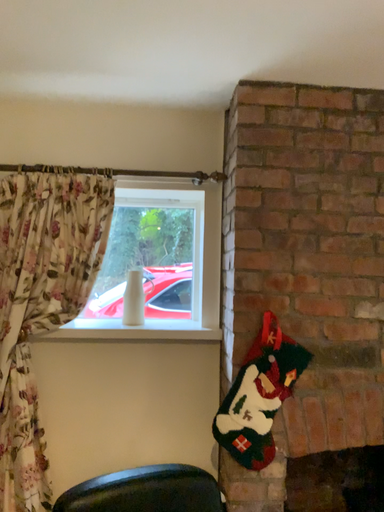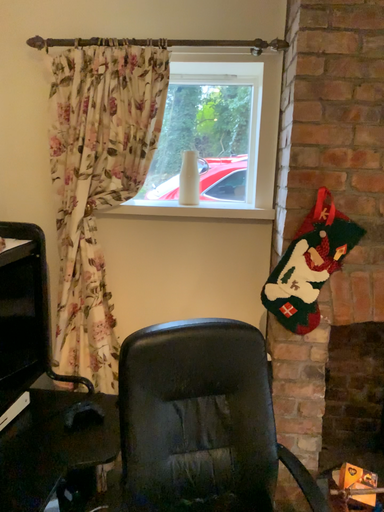
Question: Which way did the camera rotate in the video?

Choices:
 (A) rotated upward
 (B) rotated downward

Answer: (B)